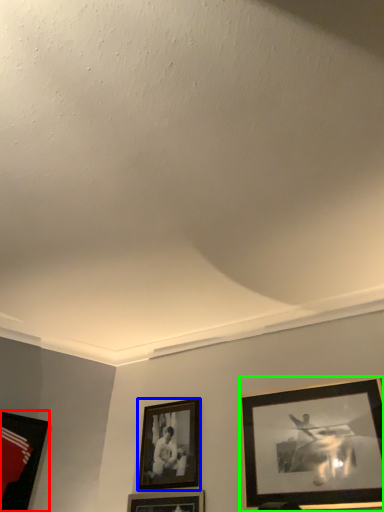
Question: Which object is the closest to the picture frame (highlighted by a red box)? Choose among these: picture frame (highlighted by a blue box) or picture frame (highlighted by a green box).

Choices:
 (A) picture frame
 (B) picture frame

Answer: (A)